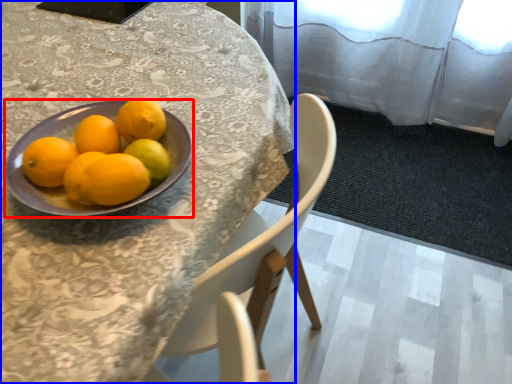
Question: Which object appears farthest to the camera in this image, bowl (highlighted by a red box) or table (highlighted by a blue box)?

Choices:
 (A) bowl
 (B) table

Answer: (A)